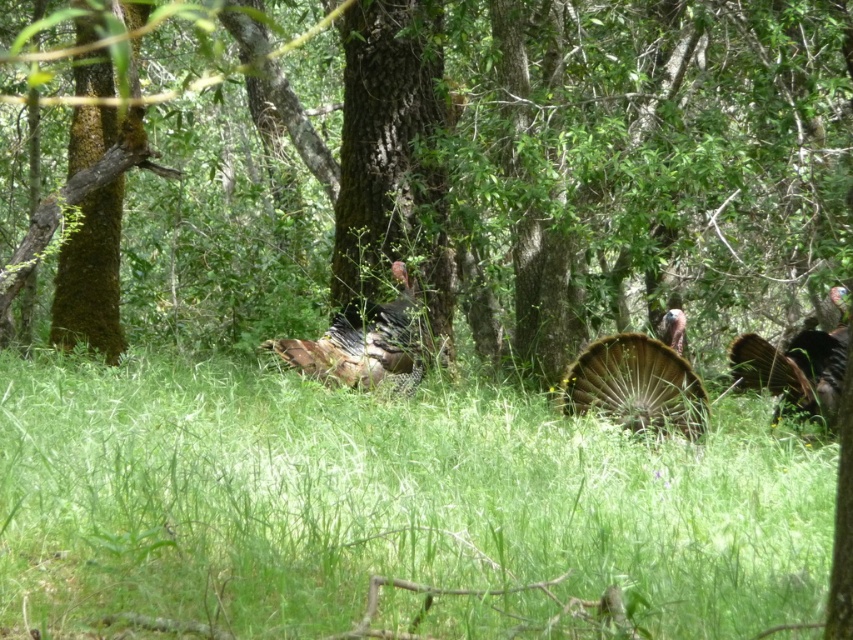
Question: Which is nearer to the feathered brown turkey at right?

Choices:
 (A) green grassy at center
 (B) green mossy tree at center
 (C) brown feathered turkey at center
 (D) brown textured feathers at center

Answer: (C)

Question: Which object is positioned closest to the feathered brown turkey at right?

Choices:
 (A) green grassy at center
 (B) brown speckled feathers at center
 (C) green mossy tree at center

Answer: (A)

Question: Does green mossy tree at center have a larger size compared to brown textured feathers at center?

Choices:
 (A) no
 (B) yes

Answer: (B)

Question: Which point is farther to the camera?

Choices:
 (A) (641, 410)
 (B) (444, 612)

Answer: (A)

Question: Can you confirm if brown textured feathers at center is positioned to the left of brown feathered turkey at center?

Choices:
 (A) no
 (B) yes

Answer: (B)

Question: Can you confirm if green grassy at center is positioned to the left of brown textured feathers at center?

Choices:
 (A) yes
 (B) no

Answer: (A)